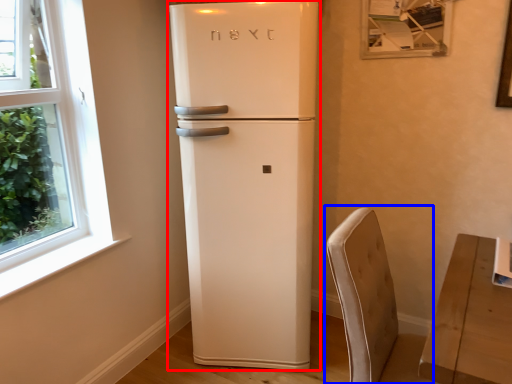
Question: Which of the following is the farthest to the observer, refrigerator (highlighted by a red box) or armchair (highlighted by a blue box)?

Choices:
 (A) refrigerator
 (B) armchair

Answer: (A)